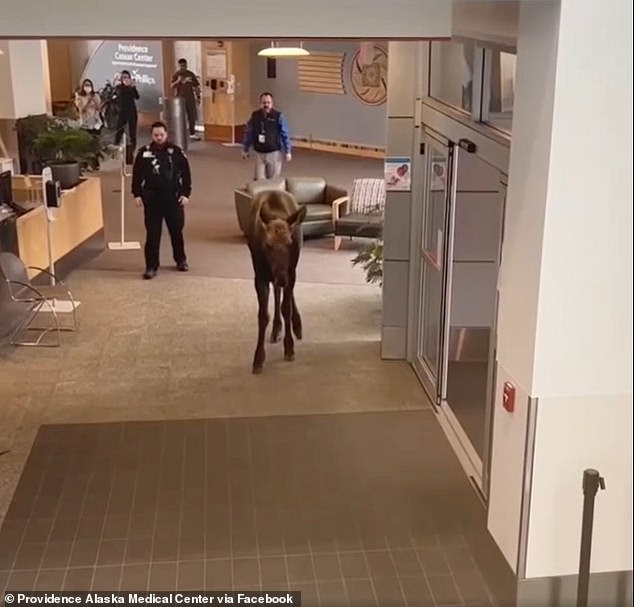
The height and width of the screenshot is (607, 634). Find the location of `left hand sanitizer station`. left hand sanitizer station is located at coordinates (53, 188).